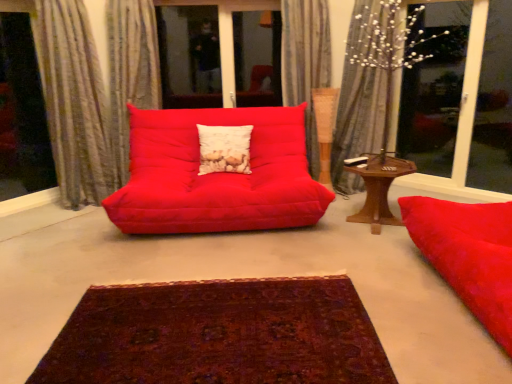
Question: Can you confirm if transparent glass window screen at left is taller than textured grey curtain at left, which is counted as the first curtain, starting from the left?

Choices:
 (A) yes
 (B) no

Answer: (A)

Question: Can you confirm if transparent glass window screen at left is smaller than textured grey curtain at left, which is counted as the first curtain, starting from the left?

Choices:
 (A) yes
 (B) no

Answer: (A)

Question: Does transparent glass window screen at left appear on the right side of textured grey curtain at left, which is counted as the first curtain, starting from the left?

Choices:
 (A) yes
 (B) no

Answer: (B)

Question: Is transparent glass window screen at left shorter than textured grey curtain at left, which is counted as the first curtain, starting from the left?

Choices:
 (A) yes
 (B) no

Answer: (B)

Question: Is the depth of transparent glass window screen at left less than that of textured grey curtain at left, which is counted as the first curtain, starting from the left?

Choices:
 (A) no
 (B) yes

Answer: (A)

Question: Is transparent glass window screen at left bigger than textured grey curtain at left, placed as the 4th curtain when sorted from right to left?

Choices:
 (A) yes
 (B) no

Answer: (B)

Question: From the image's perspective, is transparent glass window screen at left on transparent glass window at upper right?

Choices:
 (A) no
 (B) yes

Answer: (A)

Question: Is transparent glass window screen at left smaller than transparent glass window at upper right?

Choices:
 (A) no
 (B) yes

Answer: (B)

Question: From a real-world perspective, is transparent glass window screen at left on top of transparent glass window at upper right?

Choices:
 (A) yes
 (B) no

Answer: (A)

Question: Is transparent glass window screen at left turned away from transparent glass window at upper right?

Choices:
 (A) yes
 (B) no

Answer: (B)

Question: Does transparent glass window screen at left have a greater width compared to transparent glass window at upper right?

Choices:
 (A) no
 (B) yes

Answer: (A)

Question: From the image's perspective, is transparent glass window screen at left beneath transparent glass window at upper right?

Choices:
 (A) yes
 (B) no

Answer: (A)

Question: Can you confirm if deep burgundy woven rug at center is smaller than white textured pillow at center?

Choices:
 (A) no
 (B) yes

Answer: (A)